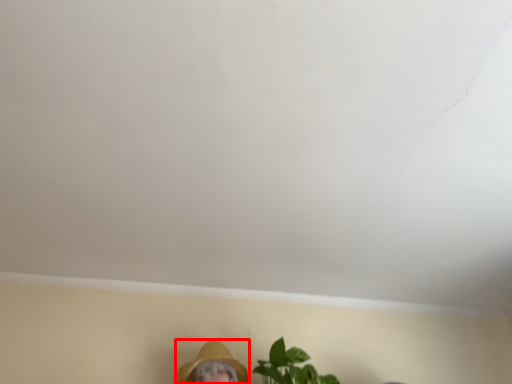
Question: From the image, what is the correct spatial relationship of person (annotated by the red box) in relation to houseplant?

Choices:
 (A) right
 (B) left

Answer: (B)